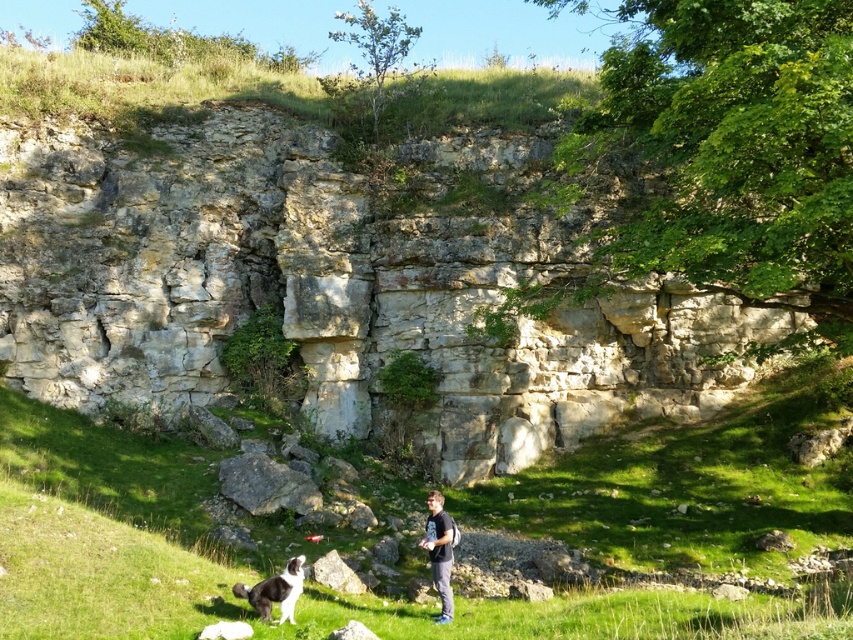
Question: Is green grassy at lower center wider than black and white fur at lower left?

Choices:
 (A) yes
 (B) no

Answer: (A)

Question: Which is nearer to the dark gray t-shirt at center?

Choices:
 (A) black and white fur at lower left
 (B) green grassy at lower center

Answer: (A)

Question: Can you confirm if dark gray t-shirt at center is thinner than black and white fur at lower left?

Choices:
 (A) yes
 (B) no

Answer: (A)

Question: Which of the following is the closest to the observer?

Choices:
 (A) (293, 577)
 (B) (805, 416)

Answer: (A)

Question: Which of the following is the closest to the observer?

Choices:
 (A) green grassy at lower center
 (B) dark gray t-shirt at center
 (C) black and white fur at lower left

Answer: (A)

Question: Does dark gray t-shirt at center have a larger size compared to black and white fur at lower left?

Choices:
 (A) no
 (B) yes

Answer: (A)